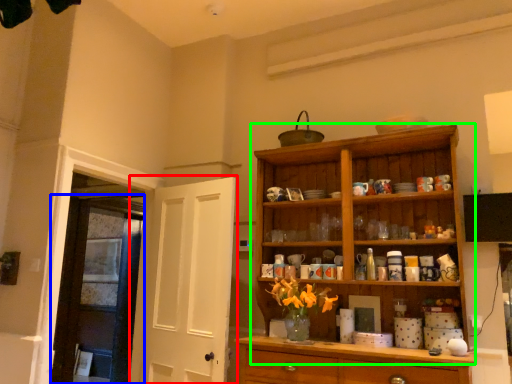
Question: Considering the real-world distances, which object is farthest from door (highlighted by a red box)? door (highlighted by a blue box) or cupboard (highlighted by a green box)?

Choices:
 (A) door
 (B) cupboard

Answer: (B)